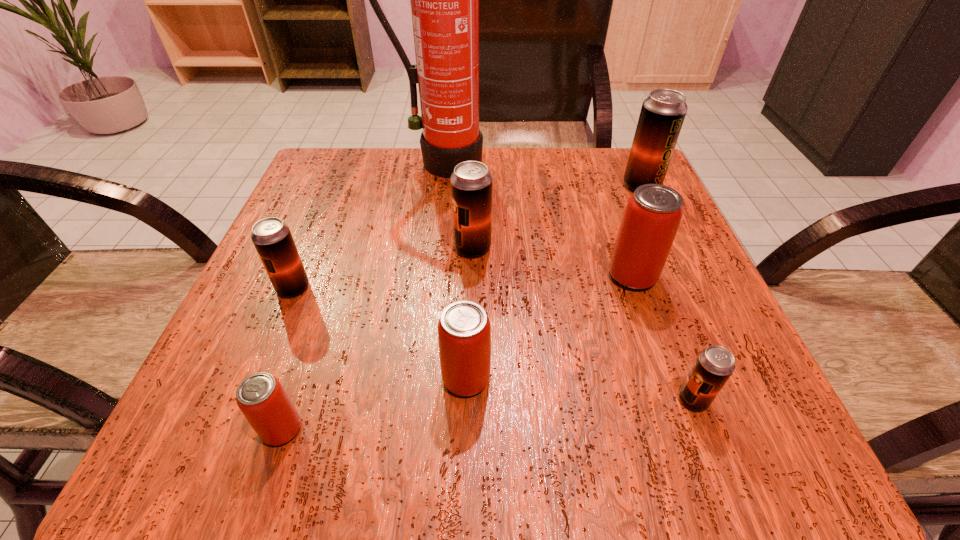
Locate an element on the screen. The width and height of the screenshot is (960, 540). the second nearest pink beer can is located at coordinates (464, 336).

The width and height of the screenshot is (960, 540). I want to click on the second smallest pink beer can, so click(x=464, y=336).

Where is `the leftmost pink beer can`? Image resolution: width=960 pixels, height=540 pixels. the leftmost pink beer can is located at coordinates (262, 399).

At what (x,y) coordinates should I click in order to perform the action: click on the second beer can from left to right. Please return your answer as a coordinate pair (x, y). This screenshot has height=540, width=960. Looking at the image, I should click on (262, 399).

Image resolution: width=960 pixels, height=540 pixels. What are the coordinates of `the nearest black beer can` in the screenshot? It's located at (714, 365).

Image resolution: width=960 pixels, height=540 pixels. I want to click on the smallest black beer can, so click(x=714, y=365).

This screenshot has height=540, width=960. I want to click on vacant region located on the front-facing side of the fire extinguisher, so click(x=434, y=227).

Locate an element on the screen. The height and width of the screenshot is (540, 960). free space located 0.210m on the front of the farthest black beer can is located at coordinates (678, 265).

At what (x,y) coordinates should I click in order to perform the action: click on free space located on the right of the rightmost pink beer can. Please return your answer as a coordinate pair (x, y). The height and width of the screenshot is (540, 960). Looking at the image, I should click on (703, 276).

Where is `vacant region located 0.160m on the back of the second black beer can from left to right`? The height and width of the screenshot is (540, 960). vacant region located 0.160m on the back of the second black beer can from left to right is located at coordinates (473, 188).